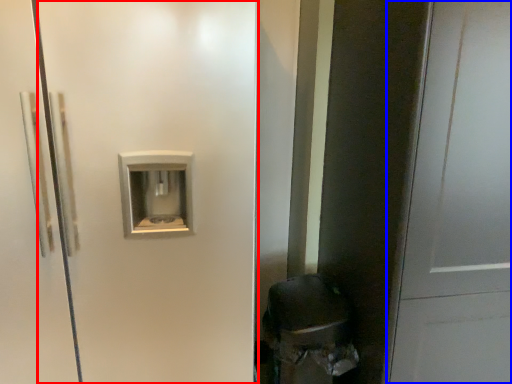
Question: Which object appears farthest to the camera in this image, screen door (highlighted by a red box) or door (highlighted by a blue box)?

Choices:
 (A) screen door
 (B) door

Answer: (A)